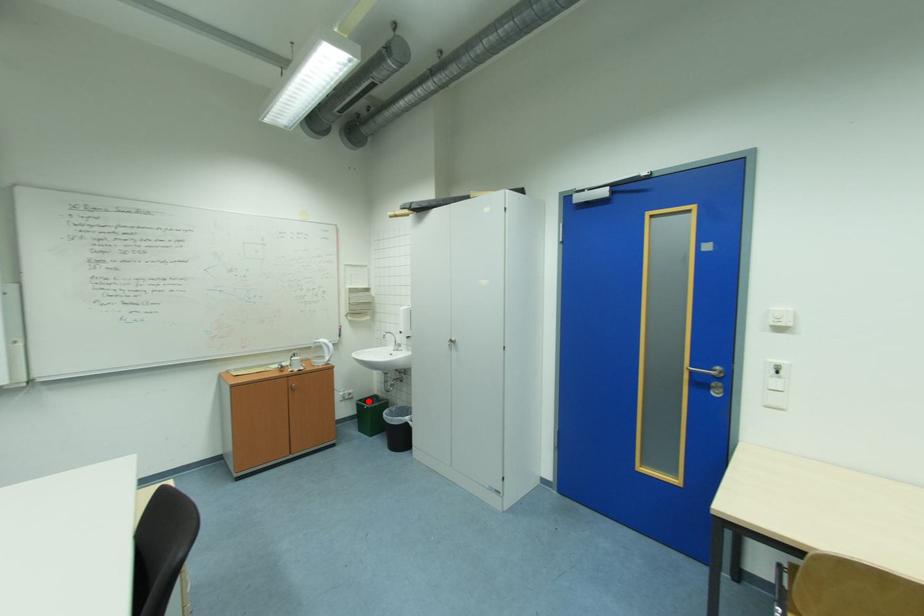
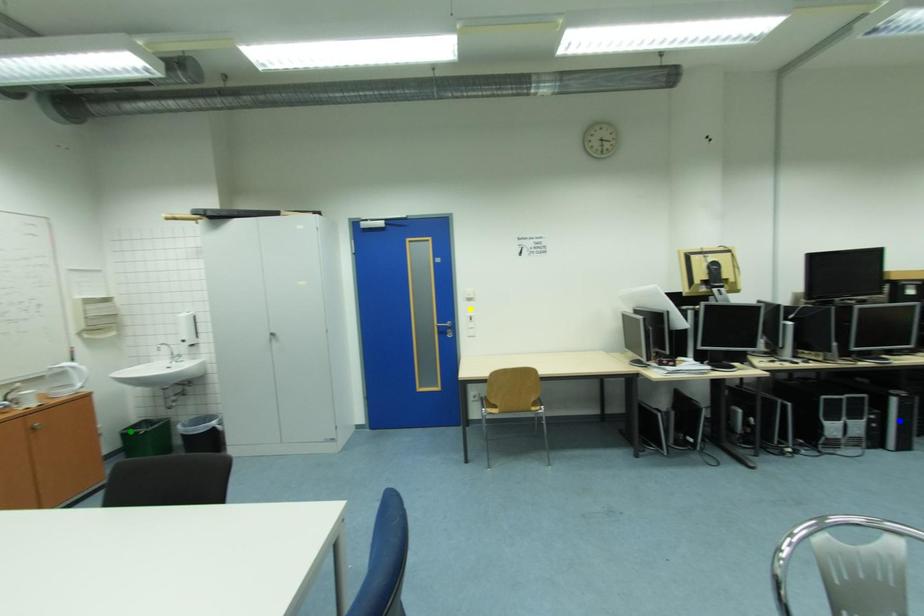
Question: I am providing you with two images of the same scene from different viewpoints. A red point is marked on the first image. You are given multiple points on the second image. Which point in image 2 represents the same 3d spot as the red point in image 1?

Choices:
 (A) blue point
 (B) green point
 (C) yellow point

Answer: (B)